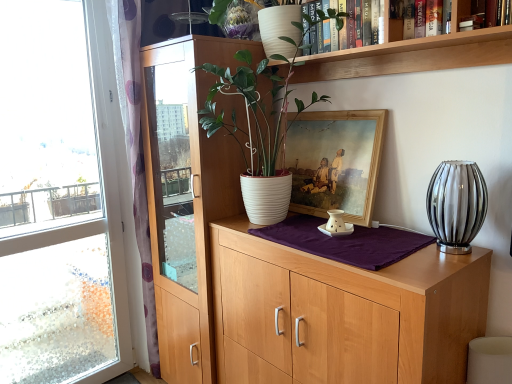
Question: From a real-world perspective, relative to white matte shelf at upper center, is light wood cabinet at center vertically above or below?

Choices:
 (A) above
 (B) below

Answer: (B)

Question: Do you think light wood cabinet at center is within white matte shelf at upper center, or outside of it?

Choices:
 (A) inside
 (B) outside

Answer: (B)

Question: Based on their relative distances, which object is farther from the transparent glass window at left?

Choices:
 (A) hardcover book at upper right, acting as the 2th book starting from the left
 (B) white matte shelf at upper center
 (C) wooden framed painting at center
 (D) hardcover book at upper right, marked as the first book in a right-to-left arrangement
 (E) light wood cabinet at center

Answer: (D)

Question: Which object is positioned farthest from the white matte shelf at upper center?

Choices:
 (A) wooden framed painting at center
 (B) translucent glass vase at right
 (C) hardcover book at upper right, placed as the 2th book when sorted from front to back
 (D) transparent glass window at left
 (E) white ribbed pot at center

Answer: (D)